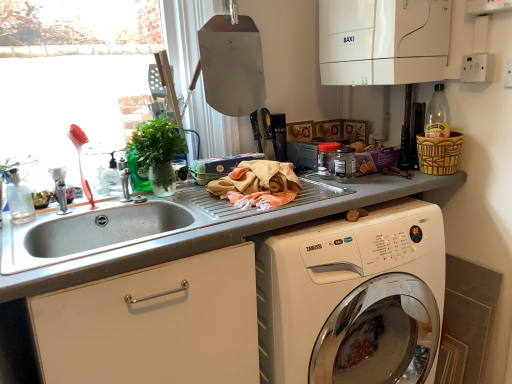
Question: Considering the relative positions of white glossy boiler at upper right, marked as the third appliance in a bottom-to-top arrangement, and green leafy plant at upper left in the image provided, is white glossy boiler at upper right, marked as the third appliance in a bottom-to-top arrangement, to the left or to the right of green leafy plant at upper left?

Choices:
 (A) left
 (B) right

Answer: (B)

Question: From a real-world perspective, is white glossy boiler at upper right, the first appliance from the top, above or below green leafy plant at upper left?

Choices:
 (A) below
 (B) above

Answer: (B)

Question: Which of these objects is positioned farthest from the white glossy boiler at upper right, marked as the third appliance in a bottom-to-top arrangement?

Choices:
 (A) clear glass bottle at sink left
 (B) transparent glass window screen at upper left
 (C) white glossy washing machine at lower right
 (D) pink plastic brush at left
 (E) smooth gray countertop at center

Answer: (B)

Question: Estimate the real-world distances between objects in this image. Which object is closer to the pink plastic brush at left?

Choices:
 (A) green leafy plant at upper left
 (B) woven brown basket at upper right
 (C) white glossy boiler at upper right, the first appliance from the top
 (D) white glossy washing machine at lower right
 (E) clear glass bottle at sink left

Answer: (E)